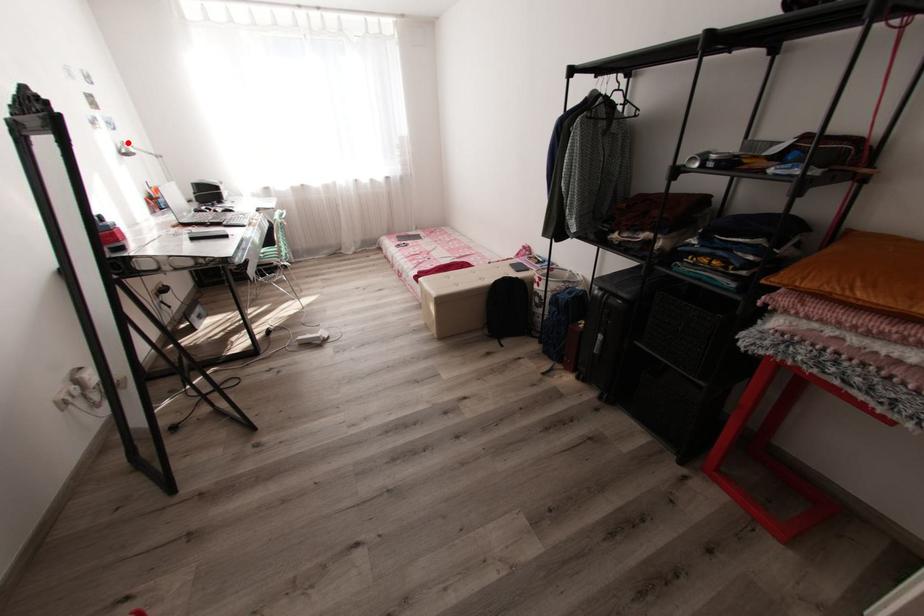
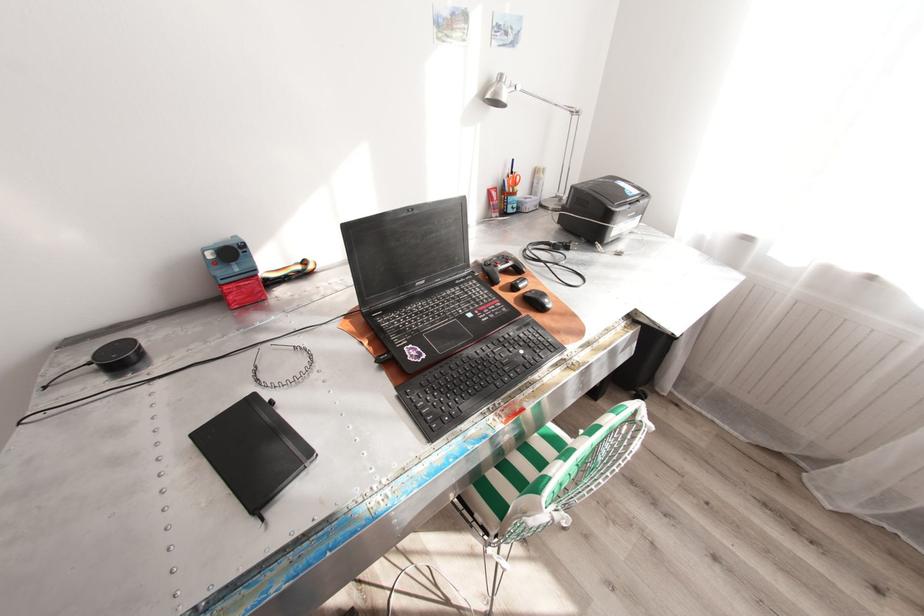
Question: I am providing you with two images of the same scene from different viewpoints. Given a red point in image1, look at the same physical point in image2. Is it:

Choices:
 (A) Closer to the viewpoint
 (B) Farther from the viewpoint

Answer: (A)